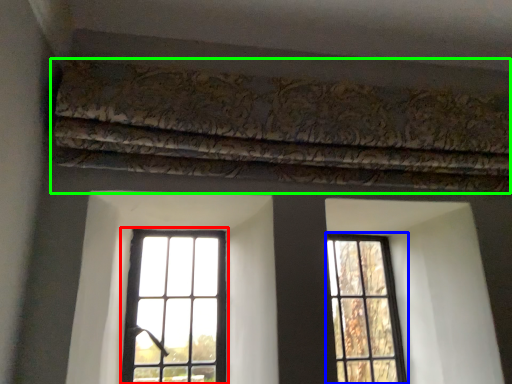
Question: Estimate the real-world distances between objects in this image. Which object is closer to window (highlighted by a red box), window (highlighted by a blue box) or curtain (highlighted by a green box)?

Choices:
 (A) window
 (B) curtain

Answer: (A)